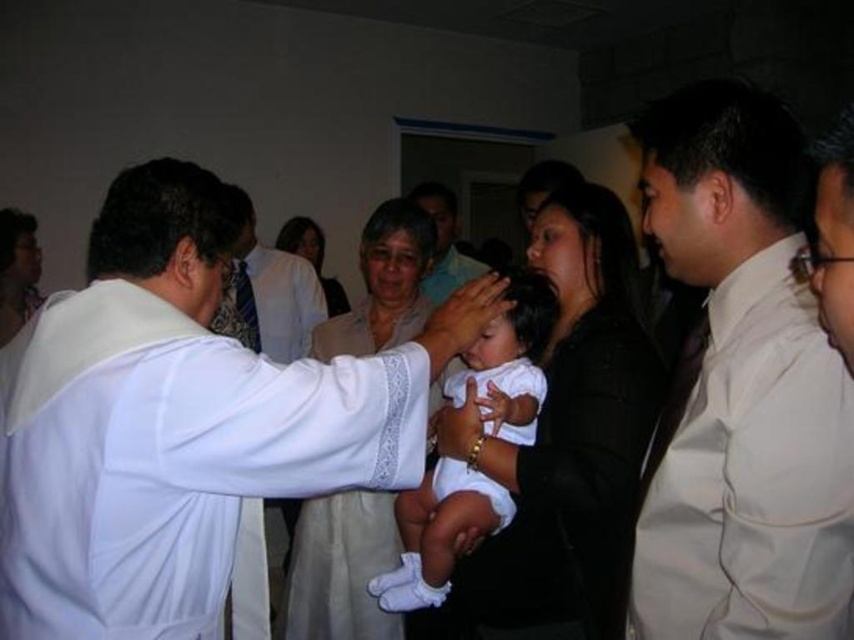
You are a photographer in a dimly lit church. You need to capture a photo of the white clothed baby at center and the white satin robe at center. Which object should you focus on first if you want to ensure both are in focus?

The white clothed baby at center is located below the white satin robe at center, so focusing on the white satin robe at center first will help ensure both are in focus since it is farther away.

You are an observer at the ceremony. You notice the smooth white shirt at center and the matte white dress at center. Which one is positioned higher relative to the other?

The smooth white shirt at center is located above the matte white dress at center, so it is positioned higher.

In the scene shown: You are an event planner organizing a baptism ceremony. You need to ensure that the white clothed baby at center and the smooth white shirt at center can fit side by side on a 1.2 meter wide table. Can they fit together?

The white clothed baby at center is wider than the smooth white shirt at center. Since their combined width would exceed 1.2 meters, they cannot fit side by side on the table.